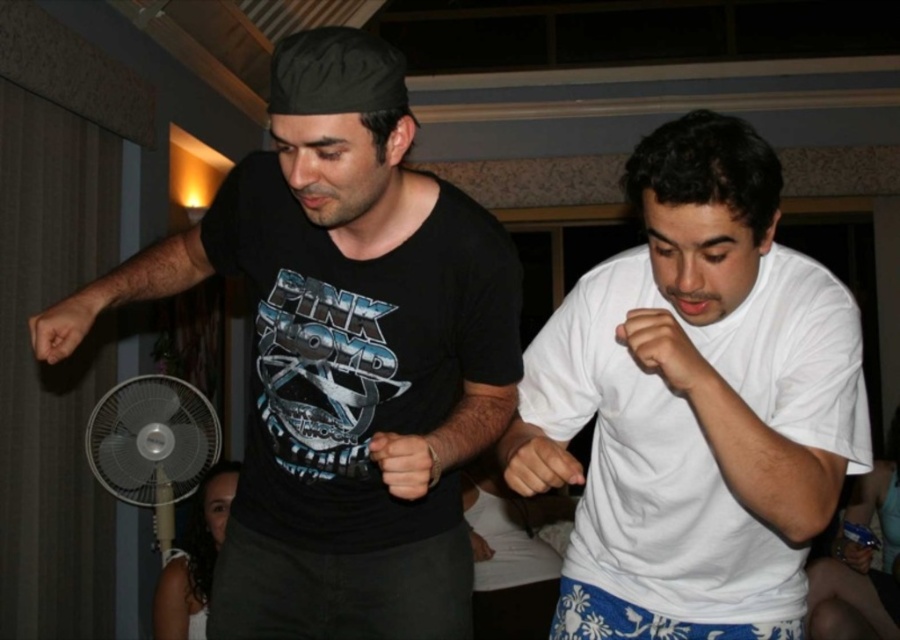
Question: Does white cotton shirt at center have a larger size compared to black matte t-shirt at center?

Choices:
 (A) no
 (B) yes

Answer: (B)

Question: Considering the real-world distances, which object is closest to the white cotton shirt at center?

Choices:
 (A) black matte t-shirt at left
 (B) white plastic fan at lower left

Answer: (A)

Question: Is black matte t-shirt at left bigger than black matte t-shirt at center?

Choices:
 (A) no
 (B) yes

Answer: (B)

Question: Among these points, which one is nearest to the camera?

Choices:
 (A) (267, 445)
 (B) (189, 387)
 (C) (741, 316)
 (D) (228, 218)

Answer: (C)

Question: Which point is closer to the camera?

Choices:
 (A) white cotton shirt at center
 (B) black matte t-shirt at center

Answer: (A)

Question: Can you confirm if white cotton shirt at center is positioned above black matte t-shirt at center?

Choices:
 (A) yes
 (B) no

Answer: (B)